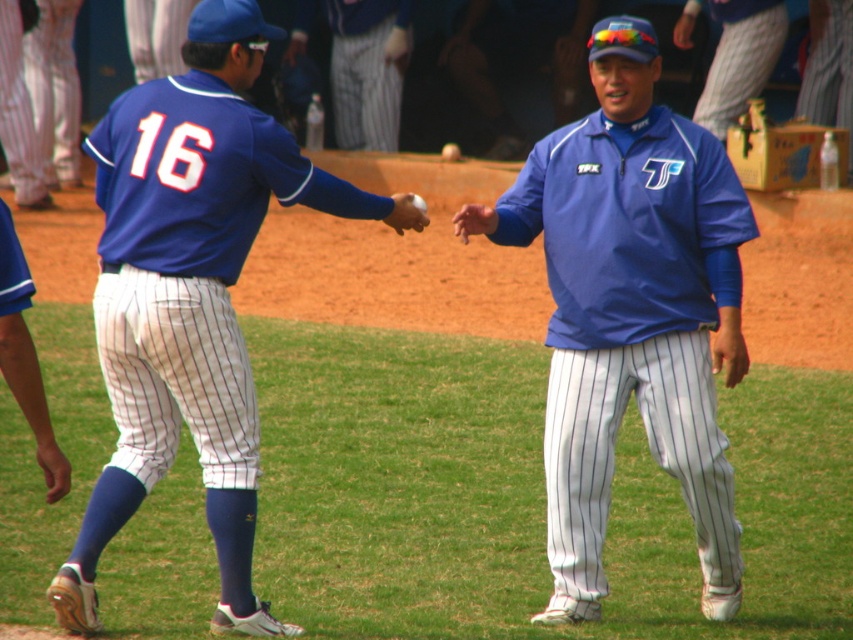
You are a photographer trying to capture a closeup of the blue fabric shirt at center and the white pinstriped pants at center. Which item should you zoom in on if you want to focus on the wider object?

The blue fabric shirt at center might be wider than white pinstriped pants at center, so you should zoom in on the blue fabric shirt at center to focus on the wider object.